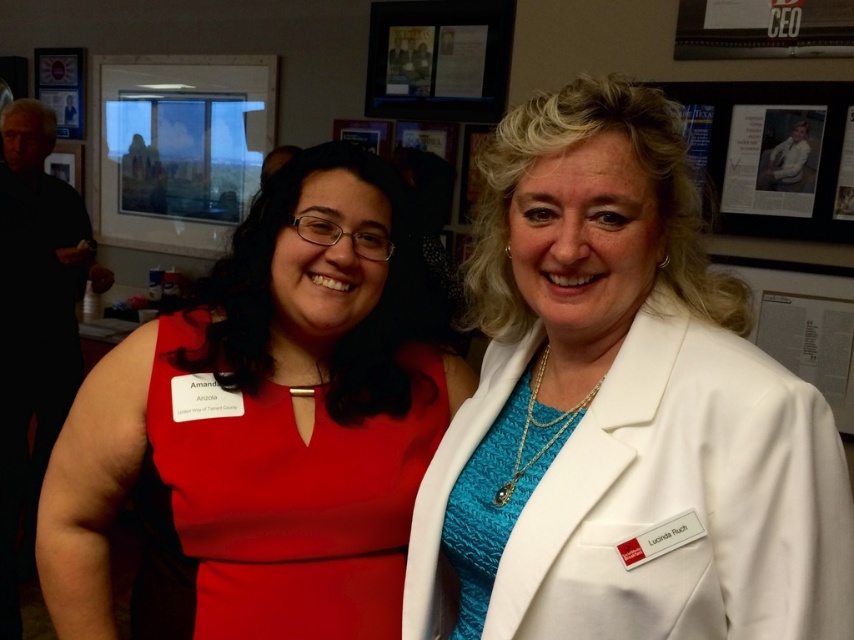
Who is positioned more to the right, satin red dress at center or matte plastic picture frame at upper center?

matte plastic picture frame at upper center is more to the right.

Measure the distance between satin red dress at center and camera.

satin red dress at center is 36.27 inches away from camera.

At what (x,y) coordinates should I click in order to perform the action: click on satin red dress at center. Please return your answer as a coordinate pair (x, y). This screenshot has width=854, height=640. Looking at the image, I should click on (x=290, y=497).

Between satin red dress at center and metallic poster at upper left, which one has more height?

metallic poster at upper left is taller.

Can you confirm if satin red dress at center is wider than metallic poster at upper left?

Yes, satin red dress at center is wider than metallic poster at upper left.

Measure the distance between point (203, 442) and camera.

Point (203, 442) is 37.52 inches from camera.

This screenshot has width=854, height=640. In order to click on satin red dress at center in this screenshot , I will do `click(290, 497)`.

Who is positioned more to the right, white satin blazer at center or metallic poster at upper left?

Positioned to the right is white satin blazer at center.

Is the position of white satin blazer at center less distant than that of metallic poster at upper left?

That is True.

The height and width of the screenshot is (640, 854). Describe the element at coordinates (621, 412) in the screenshot. I see `white satin blazer at center` at that location.

Where is `white satin blazer at center`? The image size is (854, 640). white satin blazer at center is located at coordinates (621, 412).